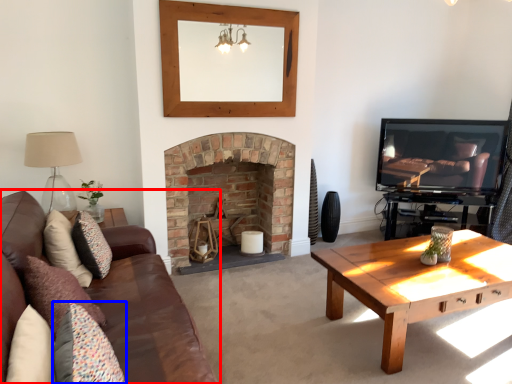
Question: Which object is further to the camera taking this photo, studio couch (highlighted by a red box) or pillow (highlighted by a blue box)?

Choices:
 (A) studio couch
 (B) pillow

Answer: (B)